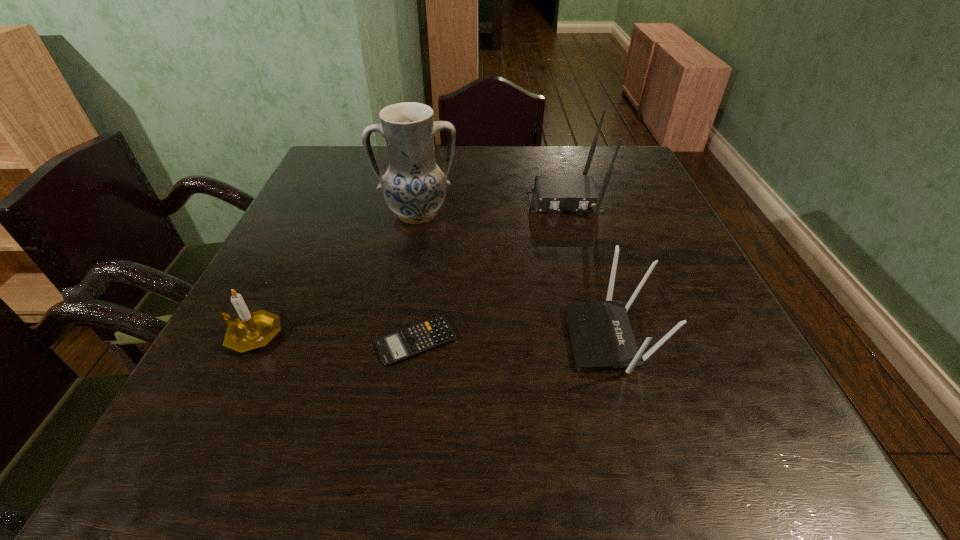
Identify the location of pottery. The width and height of the screenshot is (960, 540). (414, 186).

Find the location of a particular element. The width and height of the screenshot is (960, 540). the second tallest object is located at coordinates (551, 193).

This screenshot has width=960, height=540. I want to click on the taller router, so click(551, 193).

Identify the location of the shorter router. The width and height of the screenshot is (960, 540). (602, 337).

At what (x,y) coordinates should I click in order to perform the action: click on the leftmost object. Please return your answer as a coordinate pair (x, y). This screenshot has width=960, height=540. Looking at the image, I should click on (249, 331).

The height and width of the screenshot is (540, 960). Find the location of `the shortest object`. the shortest object is located at coordinates (400, 345).

Find the location of a particular element. Image resolution: width=960 pixels, height=540 pixels. vacant area situated on the right of the pottery is located at coordinates (530, 214).

What are the coordinates of `vacant space situated on the back of the farther router to connect cables` in the screenshot? It's located at (574, 235).

Locate an element on the screen. free space located 0.380m on the front-facing side of the nearer router is located at coordinates (364, 338).

Locate an element on the screen. This screenshot has width=960, height=540. free space located on the front-facing side of the nearer router is located at coordinates (358, 338).